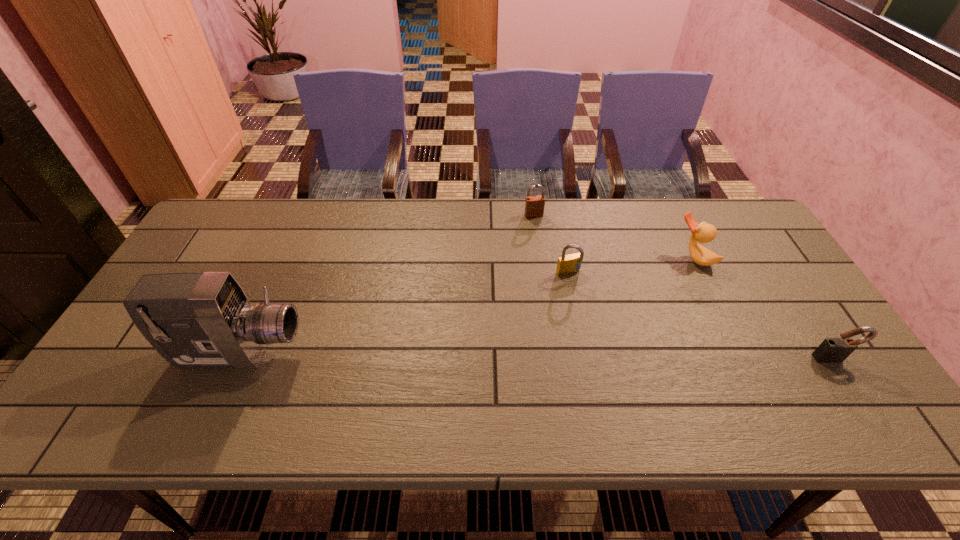
This screenshot has height=540, width=960. In order to click on padlock that is at the far edge in this screenshot , I will do `click(534, 205)`.

Find the location of a particular element. This screenshot has width=960, height=540. duck that is at the far edge is located at coordinates (703, 232).

Locate an element on the screen. camcorder situated at the near edge is located at coordinates (195, 320).

Locate an element on the screen. padlock present at the near edge is located at coordinates (832, 350).

Locate an element on the screen. This screenshot has height=540, width=960. object positioned at the left edge is located at coordinates (195, 320).

You are a GUI agent. You are given a task and a screenshot of the screen. Output one action in this format:
    pyautogui.click(x=<x>, y=<y>)
    Task: Click on the object present at the right edge
    This screenshot has width=960, height=540.
    Given the screenshot: What is the action you would take?
    pyautogui.click(x=832, y=350)

Where is `object at the near left corner`? This screenshot has width=960, height=540. object at the near left corner is located at coordinates (195, 320).

At what (x,y) coordinates should I click in order to perform the action: click on object that is at the near right corner. Please return your answer as a coordinate pair (x, y). This screenshot has width=960, height=540. Looking at the image, I should click on (832, 350).

Find the location of a particular element. This screenshot has width=960, height=540. blank space at the far edge is located at coordinates (430, 198).

Identify the location of vacant space at the near edge of the desktop. (435, 380).